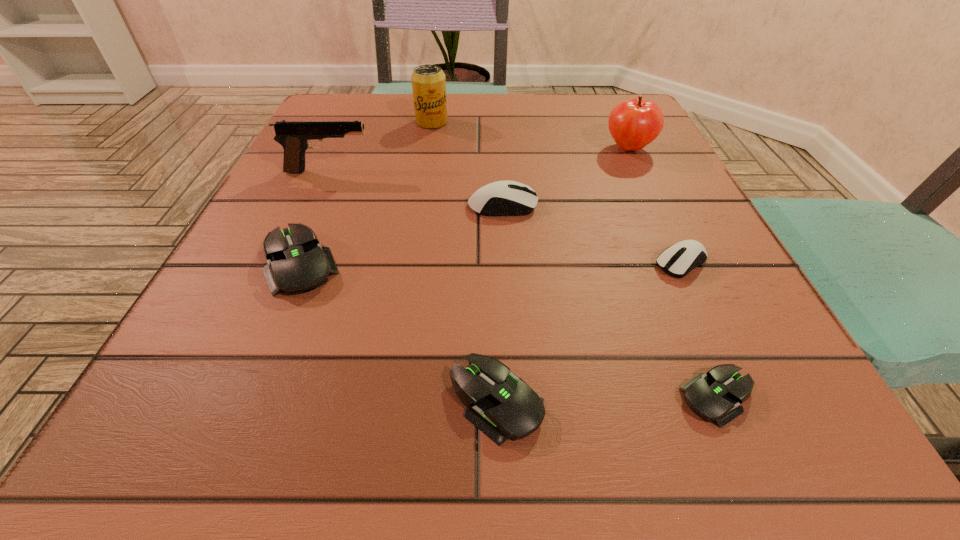
I want to click on free space located 0.180m on the left of the right white mouse, so click(x=534, y=263).

This screenshot has width=960, height=540. I want to click on vacant space located on the right of the second gray computer mouse from right to left, so click(791, 401).

Locate an element on the screen. vacant position located 0.100m on the left of the shortest object is located at coordinates (592, 397).

Identify the location of beer can present at the far edge. This screenshot has height=540, width=960. (428, 81).

What are the coordinates of `apple at the far edge` in the screenshot? It's located at (633, 124).

Image resolution: width=960 pixels, height=540 pixels. I want to click on pistol positioned at the left edge, so click(294, 136).

The image size is (960, 540). Find the location of `computer mouse present at the left edge`. computer mouse present at the left edge is located at coordinates (297, 263).

Where is `apple at the right edge`? The height and width of the screenshot is (540, 960). apple at the right edge is located at coordinates (633, 124).

Find the location of a particular element. This screenshot has width=960, height=540. object at the far right corner is located at coordinates coord(633,124).

The width and height of the screenshot is (960, 540). I want to click on object present at the near right corner, so click(715, 395).